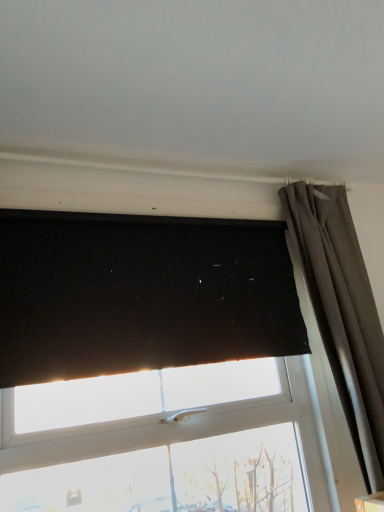
Question: Is black matte blind at upper center positioned before dark gray textured curtain at upper right?

Choices:
 (A) no
 (B) yes

Answer: (B)

Question: Is black matte blind at upper center oriented towards dark gray textured curtain at upper right?

Choices:
 (A) yes
 (B) no

Answer: (B)

Question: Can you confirm if black matte blind at upper center is shorter than dark gray textured curtain at upper right?

Choices:
 (A) yes
 (B) no

Answer: (A)

Question: Does black matte blind at upper center appear on the right side of dark gray textured curtain at upper right?

Choices:
 (A) no
 (B) yes

Answer: (A)

Question: From a real-world perspective, is black matte blind at upper center physically above dark gray textured curtain at upper right?

Choices:
 (A) no
 (B) yes

Answer: (B)

Question: From the image's perspective, is black matte blind at upper center below dark gray textured curtain at upper right?

Choices:
 (A) no
 (B) yes

Answer: (A)

Question: From the image's perspective, would you say dark gray textured curtain at upper right is positioned over black matte blind at upper center?

Choices:
 (A) no
 (B) yes

Answer: (A)

Question: Is dark gray textured curtain at upper right facing away from black matte blind at upper center?

Choices:
 (A) yes
 (B) no

Answer: (B)

Question: From a real-world perspective, is dark gray textured curtain at upper right on top of black matte blind at upper center?

Choices:
 (A) no
 (B) yes

Answer: (A)

Question: Could you tell me if dark gray textured curtain at upper right is turned towards black matte blind at upper center?

Choices:
 (A) no
 (B) yes

Answer: (A)

Question: Considering the relative sizes of dark gray textured curtain at upper right and black matte blind at upper center in the image provided, is dark gray textured curtain at upper right smaller than black matte blind at upper center?

Choices:
 (A) no
 (B) yes

Answer: (A)

Question: Can black matte blind at upper center be found inside dark gray textured curtain at upper right?

Choices:
 (A) no
 (B) yes

Answer: (A)

Question: From a real-world perspective, is dark gray textured curtain at upper right above or below black matte blind at upper center?

Choices:
 (A) above
 (B) below

Answer: (B)